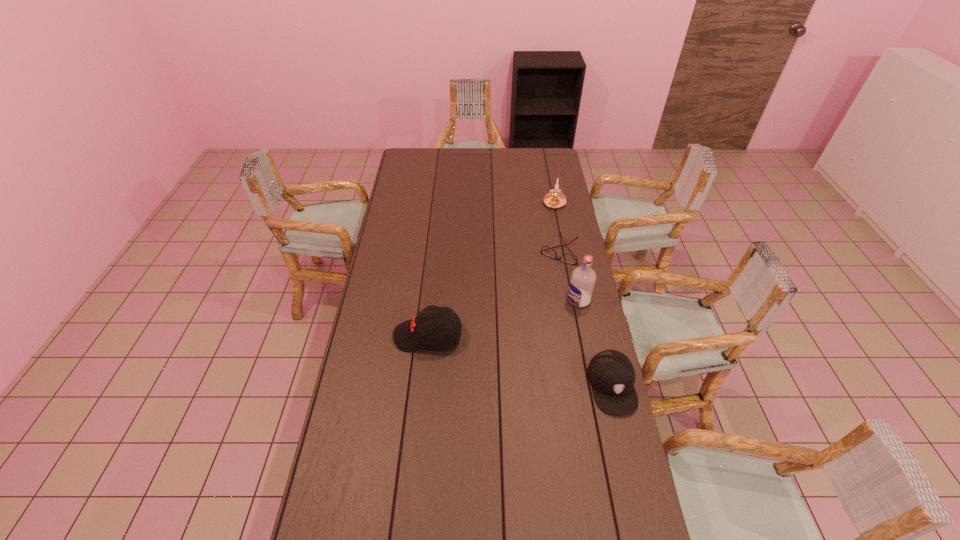
Where is `vacant area that lies between the nearest object and the second nearest object`? vacant area that lies between the nearest object and the second nearest object is located at coordinates (520, 361).

Identify the location of free space that is in between the vodka and the nearest object. (595, 342).

The height and width of the screenshot is (540, 960). In order to click on vacant space in between the third farthest object and the candle holder in this screenshot , I will do `click(566, 252)`.

Find the location of a particular element. The image size is (960, 540). the fourth closest object relative to the tallest object is located at coordinates (554, 199).

The image size is (960, 540). Identify the location of the second closest object to the nearest object. (438, 328).

At what (x,y) coordinates should I click in order to perform the action: click on vacant space that satisfies the following two spatial constraints: 1. on the front side of the shortest object; 2. on the left side of the third nearest object. Please return your answer as a coordinate pair (x, y). The image size is (960, 540). Looking at the image, I should click on (568, 300).